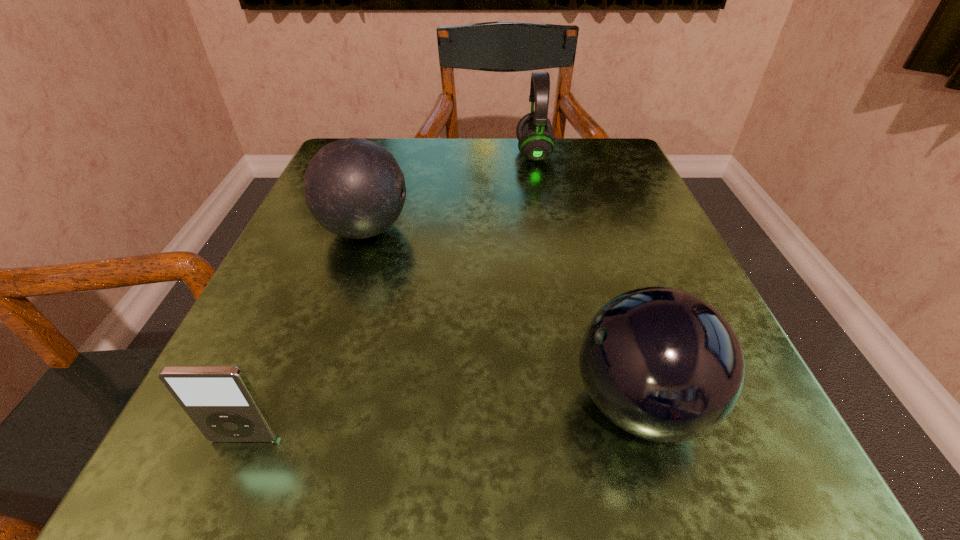
The image size is (960, 540). I want to click on object that is positioned at the near right corner, so click(x=662, y=364).

This screenshot has width=960, height=540. Find the location of `free space at the far edge of the desktop`. free space at the far edge of the desktop is located at coordinates [439, 173].

Image resolution: width=960 pixels, height=540 pixels. Identify the location of free spot at the left edge of the desktop. (301, 324).

The height and width of the screenshot is (540, 960). Identify the location of vacant region at the right edge of the desktop. (648, 194).

I want to click on free location at the near left corner of the desktop, so click(x=282, y=500).

Image resolution: width=960 pixels, height=540 pixels. In order to click on free space at the far right corner of the desktop in this screenshot , I will do `click(612, 157)`.

You are a GUI agent. You are given a task and a screenshot of the screen. Output one action in this format:
    pyautogui.click(x=<x>, y=<y>)
    Task: Click on the free space between the right bowling ball and the farthest object
    The height and width of the screenshot is (540, 960).
    Given the screenshot: What is the action you would take?
    pyautogui.click(x=587, y=279)

This screenshot has height=540, width=960. Identify the location of free spot between the third nearest object and the farthest object. (449, 192).

The width and height of the screenshot is (960, 540). I want to click on vacant area that lies between the right bowling ball and the farthest object, so click(x=587, y=279).

The height and width of the screenshot is (540, 960). I want to click on vacant space that is in between the third nearest object and the headset, so click(449, 192).